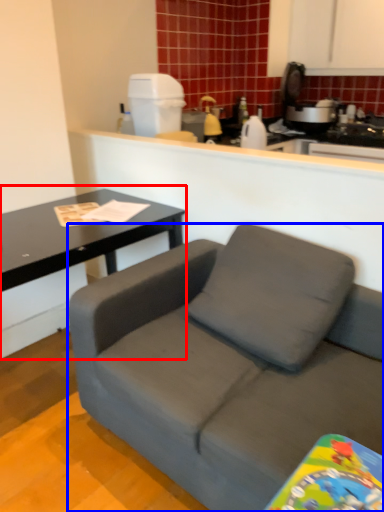
Question: Which object appears farthest to the camera in this image, coffee table (highlighted by a red box) or studio couch (highlighted by a blue box)?

Choices:
 (A) coffee table
 (B) studio couch

Answer: (A)